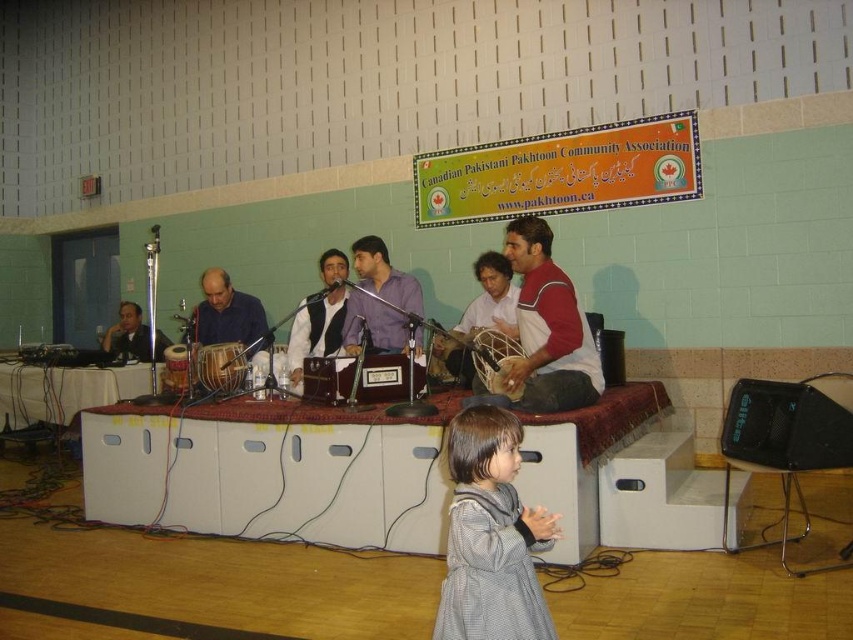
Question: Does matte black vest at center come in front of wooden drum at center?

Choices:
 (A) no
 (B) yes

Answer: (A)

Question: Which point is closer to the camera?

Choices:
 (A) (541, 273)
 (B) (460, 621)
 (C) (393, 292)
 (D) (509, 340)

Answer: (B)

Question: Does gray woolen dress at lower center appear on the right side of matte red and white shirt at center?

Choices:
 (A) yes
 (B) no

Answer: (B)

Question: Can you confirm if matte purple shirt at center is thinner than wooden drum at center?

Choices:
 (A) no
 (B) yes

Answer: (A)

Question: Which of these objects is positioned farthest from the gray woolen dress at lower center?

Choices:
 (A) matte purple shirt at center
 (B) wooden drum at center
 (C) matte red and white shirt at center
 (D) matte black vest at center

Answer: (D)

Question: Which of the following is the closest to the observer?

Choices:
 (A) (488, 360)
 (B) (392, 276)
 (C) (303, 332)

Answer: (A)